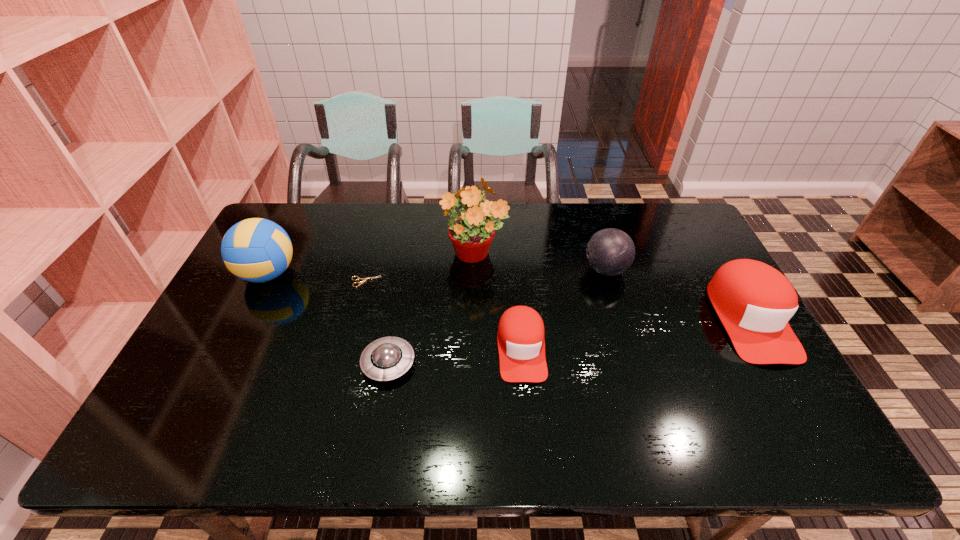
I want to click on the shorter baseball cap, so click(521, 345).

Locate an element on the screen. the left baseball cap is located at coordinates (521, 345).

At what (x,y) coordinates should I click in order to perform the action: click on the right baseball cap. Please return your answer as a coordinate pair (x, y). Looking at the image, I should click on [754, 301].

You are a GUI agent. You are given a task and a screenshot of the screen. Output one action in this format:
    pyautogui.click(x=<x>, y=<y>)
    Task: Click on the rightmost object
    Image resolution: width=960 pixels, height=540 pixels.
    Given the screenshot: What is the action you would take?
    pyautogui.click(x=754, y=301)

You are a GUI agent. You are given a task and a screenshot of the screen. Output one action in this format:
    pyautogui.click(x=<x>, y=<y>)
    Task: Click on the shears
    This screenshot has height=540, width=960.
    Given the screenshot: What is the action you would take?
    pyautogui.click(x=364, y=279)

You are a GUI agent. You are given a task and a screenshot of the screen. Output one action in this format:
    pyautogui.click(x=<x>, y=<y>)
    Task: Click on the tallest object
    Image resolution: width=960 pixels, height=540 pixels.
    Given the screenshot: What is the action you would take?
    pyautogui.click(x=471, y=233)

You are a GUI agent. You are given a task and a screenshot of the screen. Output one action in this format:
    pyautogui.click(x=<x>, y=<y>)
    Task: Click on the leftmost object
    The width and height of the screenshot is (960, 540).
    Given the screenshot: What is the action you would take?
    pyautogui.click(x=257, y=250)

At what (x,y) coordinates should I click in order to perform the action: click on the sixth shortest object. Please return your answer as a coordinate pair (x, y). Looking at the image, I should click on (257, 250).

I want to click on bowling ball, so click(610, 252).

Locate an element on the screen. The height and width of the screenshot is (540, 960). saucer is located at coordinates (387, 358).